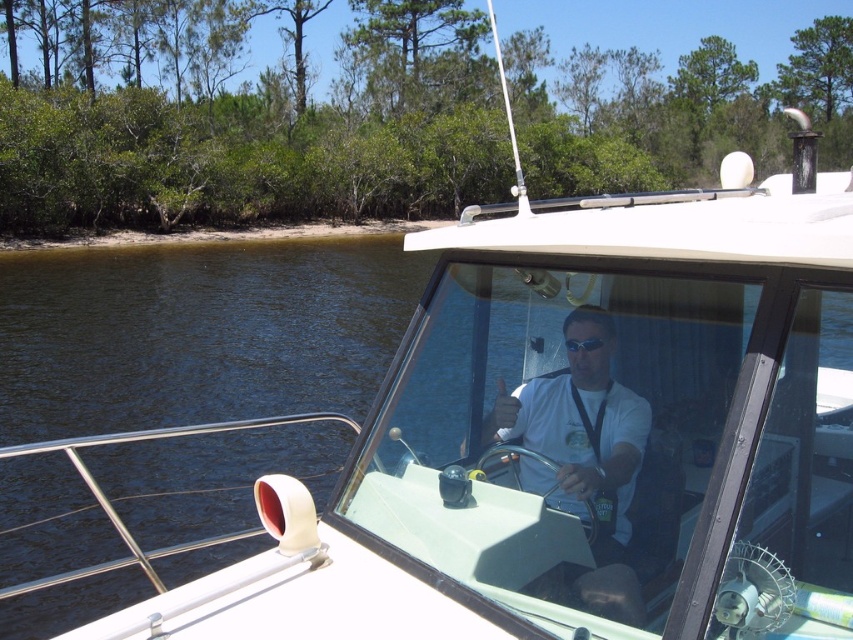
You are a safety inspector checking the equipment on the white motorboat. You notice the white matte shirt at center and the transparent plastic goggles at center. According to safety regulations, the goggles must be within 12 inches of the shirt to ensure quick access. Is the current placement compliant?

The white matte shirt at center and transparent plastic goggles at center are 12.62 inches apart, which exceeds the 12 inches requirement. Therefore, the current placement is not compliant with safety regulations.

You are a passenger on the white motorboat and want to know if the white matte shirt at center is taller than the transparent plastic goggles at center. Can you confirm this?

The white matte shirt at center has a greater height compared to transparent plastic goggles at center, so yes, the white matte shirt at center is taller than the transparent plastic goggles at center.

Based on the photo, you are a passenger on the white motorboat and want to put on your transparent plastic goggles at center. Where should you look relative to your white matte shirt at center to find them?

The transparent plastic goggles at center are on the right side of your white matte shirt at center, so you should look to your right.